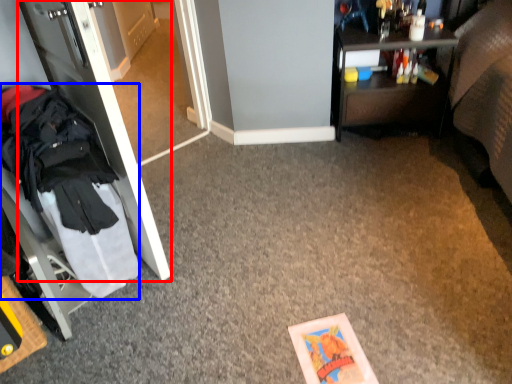
Question: Which of the following is the closest to the observer, door (highlighted by a red box) or clothing (highlighted by a blue box)?

Choices:
 (A) door
 (B) clothing

Answer: (A)